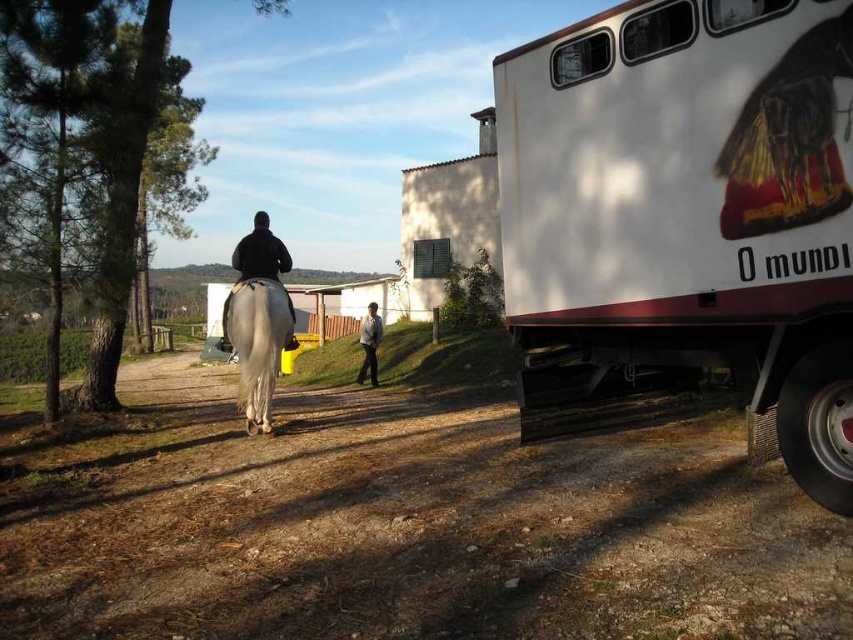
Does white glossy horse at center lie in front of light gray fabric jacket at center?

Yes, it is in front of light gray fabric jacket at center.

Is point (253, 330) closer to viewer compared to point (366, 344)?

Yes.

This screenshot has height=640, width=853. In order to click on white glossy horse at center in this screenshot , I will do `click(257, 342)`.

Does white glossy trailer truck at right lie behind white glossy horse at center?

No.

This screenshot has width=853, height=640. What are the coordinates of `white glossy trailer truck at right` in the screenshot? It's located at (692, 204).

Between point (828, 272) and point (251, 403), which one is positioned behind?

The point (251, 403) is behind.

Identify the location of white glossy trailer truck at right. The width and height of the screenshot is (853, 640). (692, 204).

Is brown dirt track at center smaller than light gray fabric jacket at center?

No.

Does brown dirt track at center have a larger size compared to light gray fabric jacket at center?

Correct, brown dirt track at center is larger in size than light gray fabric jacket at center.

At what (x,y) coordinates should I click in order to perform the action: click on brown dirt track at center. Please return your answer as a coordinate pair (x, y). This screenshot has height=640, width=853. Looking at the image, I should click on (402, 525).